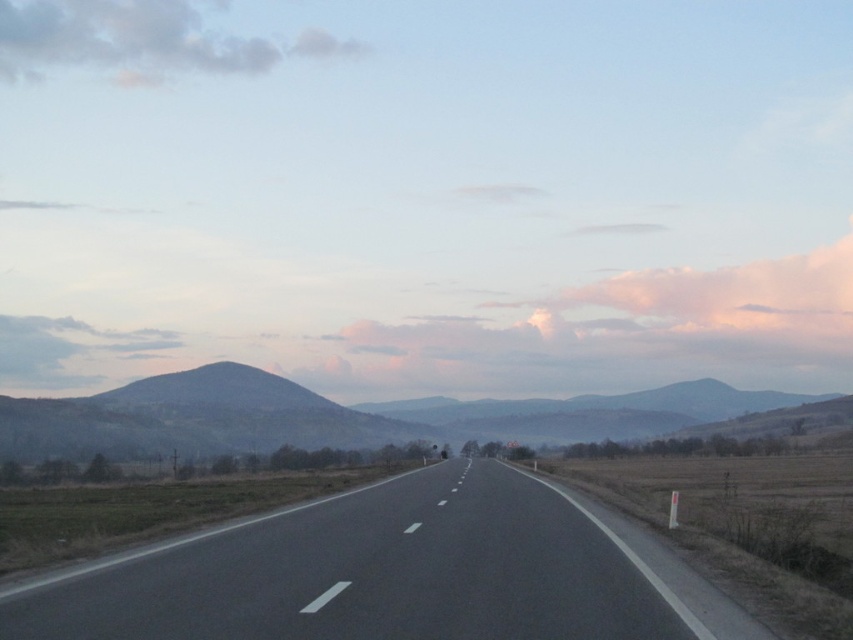
You are a drone operator planning to capture aerial footage of the black asphalt highway at center and the cloudy sky at upper left. The drone has a maximum flight range of 500 feet. Can you safely capture both locations in one flight without exceeding the drone range limit?

The black asphalt highway at center and cloudy sky at upper left are 576.86 feet apart. Since the distance exceeds the drone range of 500 feet, the drone cannot safely capture both locations in one flight without exceeding the range limit.

You are standing at the starting point of the road and see two points marked on the road ahead. The first point is at coordinates point (1,628) and the second point is at point (212,444). Which point is closer to your current position?

Point (1,628) is closer to the camera than point (212,444), so the first point is closer to your current position.

You are driving a car and see the black asphalt highway at center and the dark gray textured mountain at left. Which object is closer to the right side of the road?

The black asphalt highway at center is to the right of dark gray textured mountain at left, so the black asphalt highway at center is closer to the right side of the road.